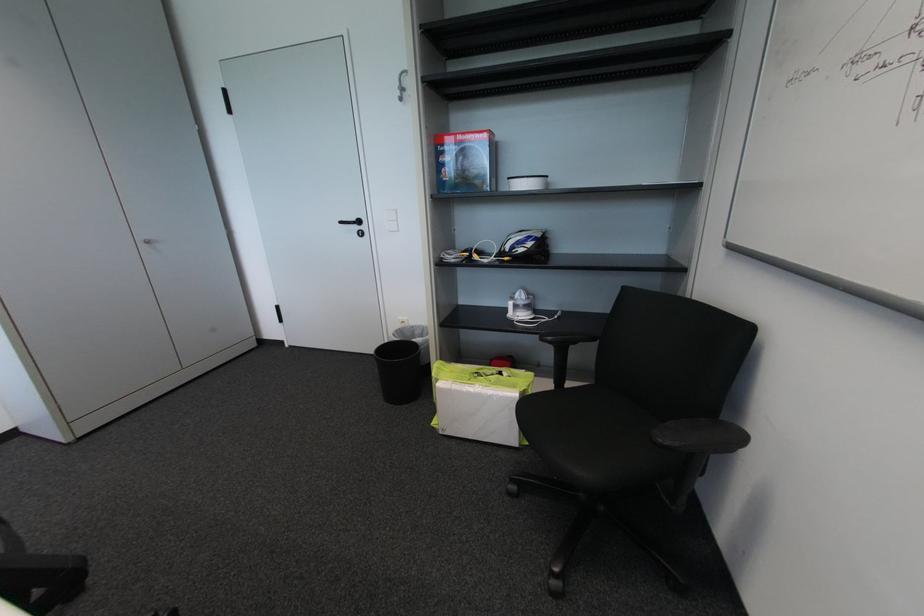
This screenshot has width=924, height=616. What do you see at coordinates (151, 244) in the screenshot? I see `the silver cabinet handle` at bounding box center [151, 244].